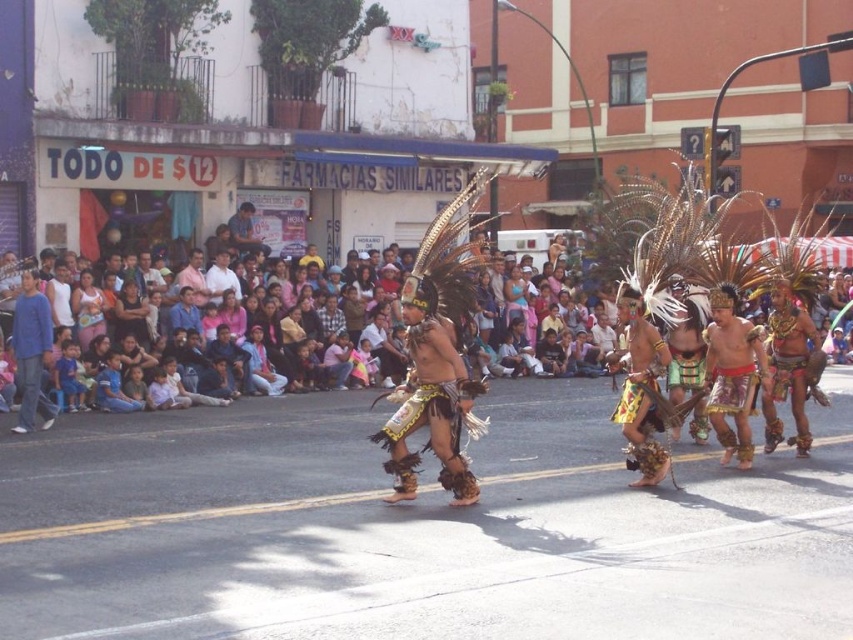
Can you confirm if blue cotton shirt at left is thinner than matte black shirt at center?

Indeed, blue cotton shirt at left has a lesser width compared to matte black shirt at center.

Does point (33, 305) lie behind point (260, 250)?

No.

Between point (39, 403) and point (242, 211), which one is positioned behind?

The point (242, 211) is behind.

The image size is (853, 640). Identify the location of blue cotton shirt at left. (32, 353).

Which is in front, point (25, 371) or point (560, 358)?

Point (25, 371) is in front.

Does blue cotton shirt at left appear on the left side of matte skin people at center?

Indeed, blue cotton shirt at left is positioned on the left side of matte skin people at center.

Locate an element on the screen. Image resolution: width=853 pixels, height=640 pixels. blue cotton shirt at left is located at coordinates (32, 353).

Find the location of `blue cotton shirt at left`. blue cotton shirt at left is located at coordinates (32, 353).

Does matte skin people at center have a larger size compared to matte black shirt at center?

Correct, matte skin people at center is larger in size than matte black shirt at center.

Is matte skin people at center to the left of matte black shirt at center from the viewer's perspective?

No, matte skin people at center is not to the left of matte black shirt at center.

Measure the distance between matte skin people at center and camera.

They are 39.96 feet apart.

This screenshot has width=853, height=640. Find the location of `matte skin people at center`. matte skin people at center is located at coordinates (135, 400).